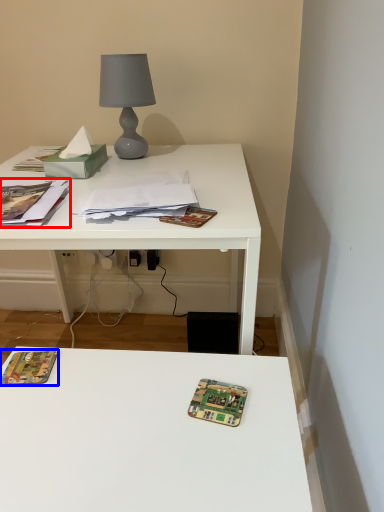
Question: Among these objects, which one is nearest to the camera, book (highlighted by a red box) or paperback book (highlighted by a blue box)?

Choices:
 (A) book
 (B) paperback book

Answer: (B)